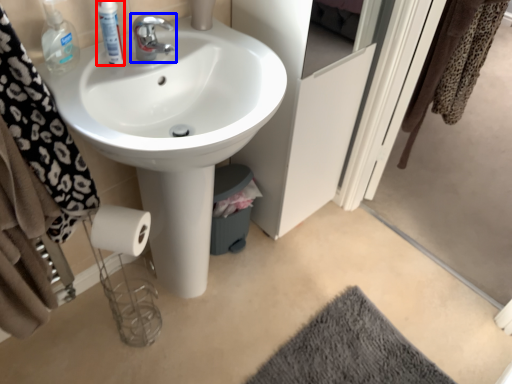
Question: Which of the following is the closest to the observer, mouthwash (highlighted by a red box) or tap (highlighted by a blue box)?

Choices:
 (A) mouthwash
 (B) tap

Answer: (A)